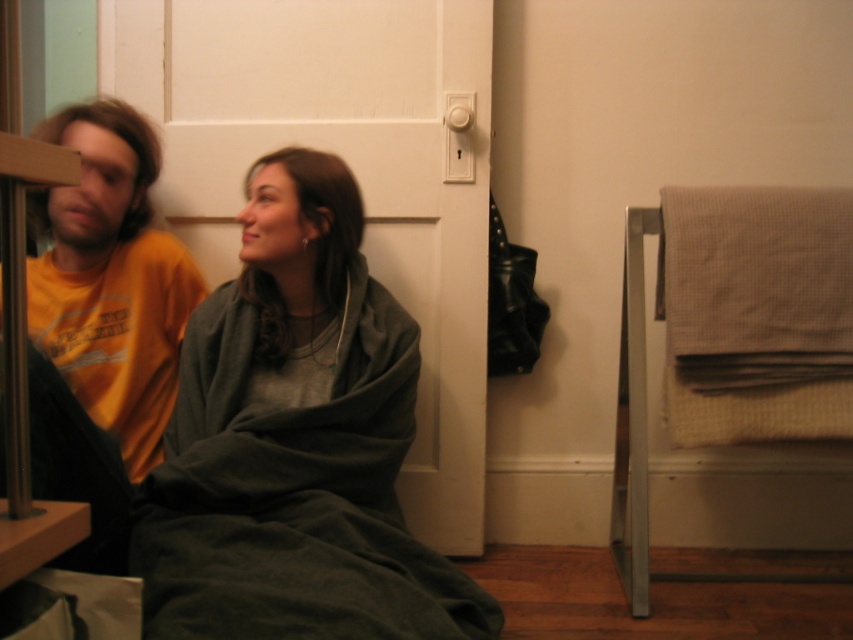
You are a delivery person needing to place a package on the floor near the beige textured towel at right. If you are standing 1.5 meters away from the towel, can you reach it without moving closer?

The beige textured towel at right is 1.71 meters away from the viewer. Since you are only 1.5 meters away from it, you are actually closer than the stated distance, so you can easily reach it without needing to move closer.